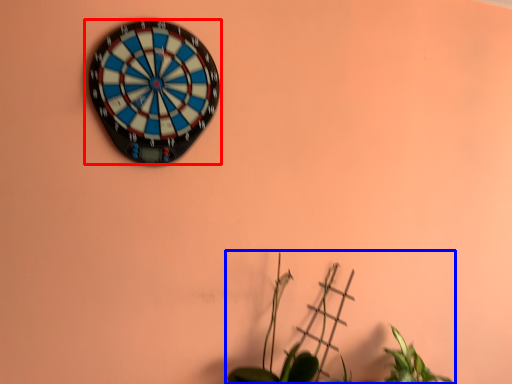
Question: Which object appears farthest to the camera in this image, wall clock (highlighted by a red box) or houseplant (highlighted by a blue box)?

Choices:
 (A) wall clock
 (B) houseplant

Answer: (A)